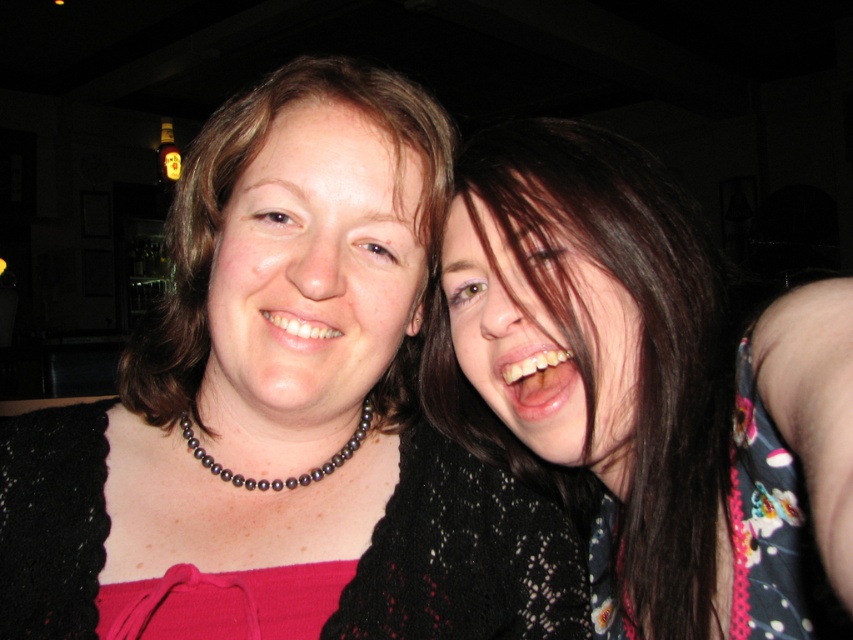
Question: Which object appears closest to the camera in this image?

Choices:
 (A) floral fabric dress at right
 (B) matte black necklace at center
 (C) dark brown hair at upper right

Answer: (C)

Question: Which point is closer to the camera taking this photo?

Choices:
 (A) (560, 572)
 (B) (521, 438)
 (C) (167, 310)
 (D) (828, 592)

Answer: (D)

Question: Can you confirm if matte black necklace at center is positioned to the right of pearl necklace at center?

Choices:
 (A) no
 (B) yes

Answer: (A)

Question: In this image, where is dark brown hair at upper right located relative to matte black necklace at center?

Choices:
 (A) above
 (B) below

Answer: (B)

Question: Which point is farther from the camera taking this photo?

Choices:
 (A) (387, 474)
 (B) (619, 556)
 (C) (525, 275)

Answer: (B)

Question: Is matte black necklace at upper left positioned in front of dark brown hair at upper right?

Choices:
 (A) yes
 (B) no

Answer: (B)